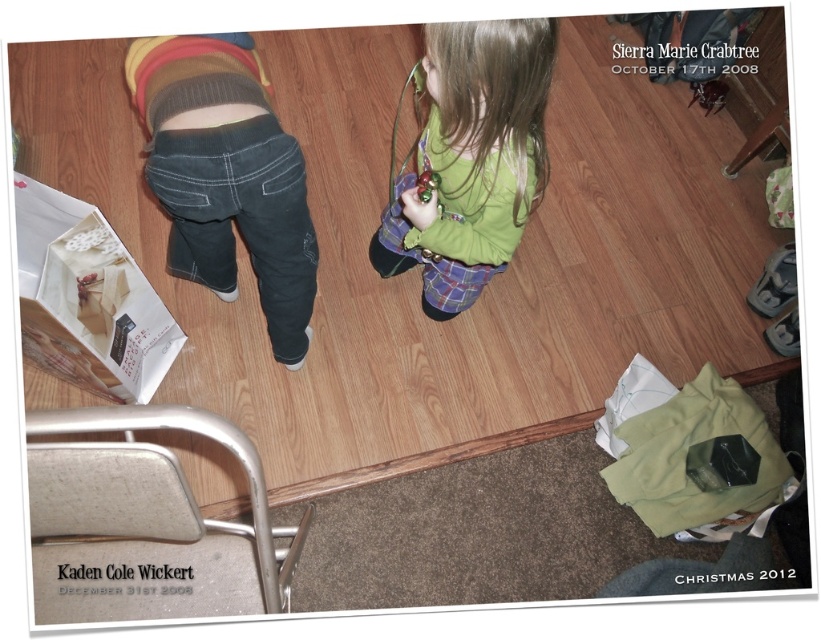
Question: Which point is farther from the camera taking this photo?

Choices:
 (A) (641, 506)
 (B) (175, 112)
 (C) (24, 269)

Answer: (A)

Question: Does denim jeans at center appear over green fabric shopping bag at lower right?

Choices:
 (A) no
 (B) yes

Answer: (B)

Question: Is green matte shirt at center bigger than green fabric shopping bag at lower right?

Choices:
 (A) yes
 (B) no

Answer: (A)

Question: Which is farther from the white paper shopping bag at lower left?

Choices:
 (A) green matte shirt at center
 (B) green fabric shopping bag at lower right
 (C) denim jeans at center

Answer: (B)

Question: Considering the relative positions of denim jeans at center and white paper shopping bag at lower left in the image provided, where is denim jeans at center located with respect to white paper shopping bag at lower left?

Choices:
 (A) below
 (B) above

Answer: (B)

Question: Which object is the farthest from the white paper shopping bag at lower left?

Choices:
 (A) denim jeans at center
 (B) green fabric shopping bag at lower right
 (C) green matte shirt at center

Answer: (B)